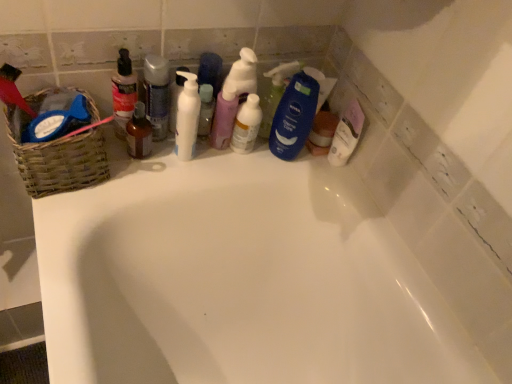
The height and width of the screenshot is (384, 512). I want to click on free spot in front of pastel pink pump bottle at center, which ranks as the 2th cleaning product in left-to-right order, so click(188, 167).